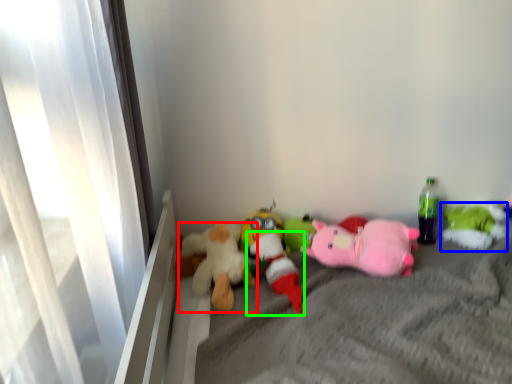
Question: Which is nearer to the toy (highlighted by a red box)? toy (highlighted by a blue box) or toy (highlighted by a green box).

Choices:
 (A) toy
 (B) toy

Answer: (B)